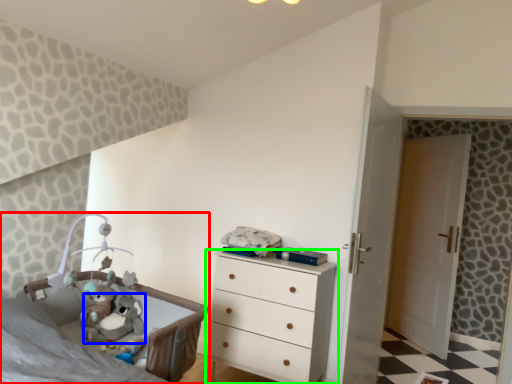
Question: Based on their relative distances, which object is farther from infant bed (highlighted by a red box)? Choose from animal (highlighted by a blue box) and chest of drawers (highlighted by a green box).

Choices:
 (A) animal
 (B) chest of drawers

Answer: (B)